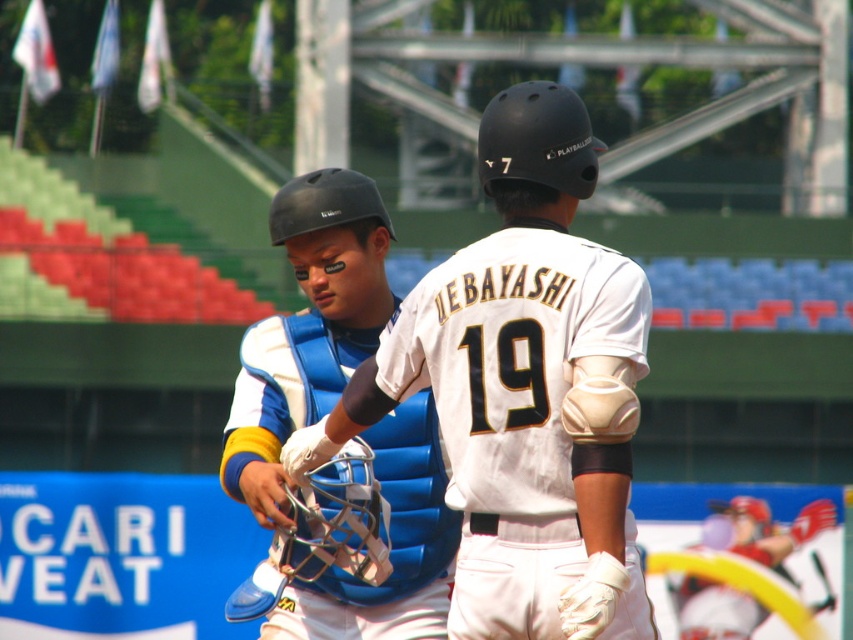
Between point (630, 346) and point (403, 408), which one is positioned behind?

The point (403, 408) is more distant.

How much distance is there between white matte baseball glove at center and blue padded chest protector at center?

5.56 feet

This screenshot has height=640, width=853. In order to click on white matte baseball glove at center in this screenshot , I will do `click(524, 388)`.

Can you confirm if white matte baseball glove at center is taller than matte red helmet at lower right?

Indeed, white matte baseball glove at center has a greater height compared to matte red helmet at lower right.

What are the coordinates of `white matte baseball glove at center` in the screenshot? It's located at (524, 388).

At what (x,y) coordinates should I click in order to perform the action: click on white matte baseball glove at center. Please return your answer as a coordinate pair (x, y). Image resolution: width=853 pixels, height=640 pixels. Looking at the image, I should click on (524, 388).

Find the location of `white matte baseball glove at center`. white matte baseball glove at center is located at coordinates (524, 388).

Does blue padded chest protector at center have a lesser height compared to matte red helmet at lower right?

In fact, blue padded chest protector at center may be taller than matte red helmet at lower right.

Where is `blue padded chest protector at center`? blue padded chest protector at center is located at coordinates (306, 330).